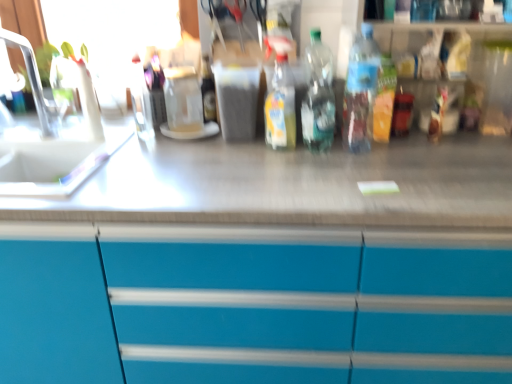
Identify the location of vacant space in front of transparent plastic bottle at center, which ranks as the second bottle in right-to-left order. (316, 170).